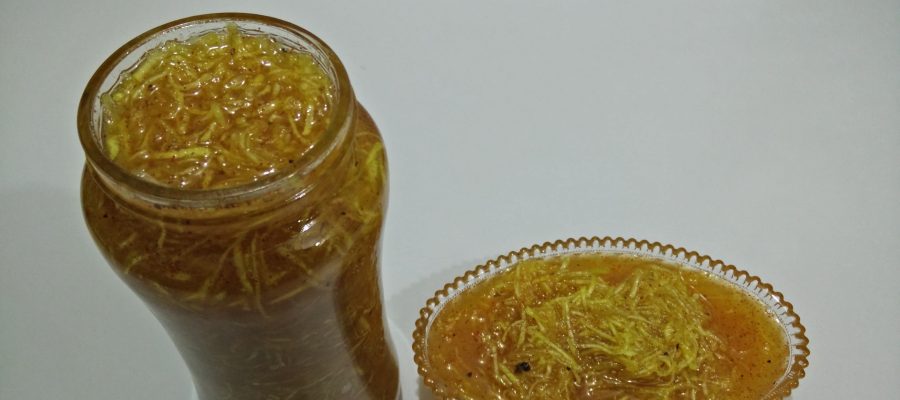
Locate an element on the screen. square white reflection on front of cup is located at coordinates [x=338, y=261], [x=371, y=391], [x=201, y=391], [x=136, y=286].